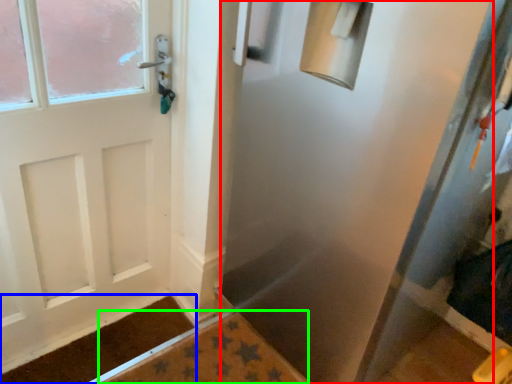
Question: Which is nearer to the screen door (highlighted by a red box)? doormat (highlighted by a blue box) or bath mat (highlighted by a green box).

Choices:
 (A) doormat
 (B) bath mat

Answer: (B)